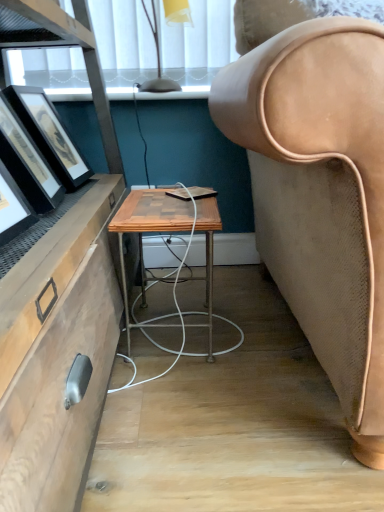
Question: Does wooden/matte desk at center have a lesser height compared to translucent yellow glass lampshade at upper center?

Choices:
 (A) no
 (B) yes

Answer: (A)

Question: Is wooden/matte desk at center looking in the opposite direction of translucent yellow glass lampshade at upper center?

Choices:
 (A) no
 (B) yes

Answer: (A)

Question: Is wooden/matte desk at center further to camera compared to translucent yellow glass lampshade at upper center?

Choices:
 (A) no
 (B) yes

Answer: (A)

Question: Is wooden/matte desk at center with translucent yellow glass lampshade at upper center?

Choices:
 (A) no
 (B) yes

Answer: (A)

Question: Can you confirm if wooden/matte desk at center is positioned to the left of translucent yellow glass lampshade at upper center?

Choices:
 (A) no
 (B) yes

Answer: (A)

Question: In the image, is wooden/matte desk at center positioned in front of or behind matte black picture frame at left?

Choices:
 (A) behind
 (B) front

Answer: (B)

Question: From their relative heights in the image, would you say wooden/matte desk at center is taller or shorter than matte black picture frame at left?

Choices:
 (A) tall
 (B) short

Answer: (A)

Question: From the image's perspective, is wooden/matte desk at center positioned above or below matte black picture frame at left?

Choices:
 (A) below
 (B) above

Answer: (A)

Question: Choose the correct answer: Is wooden/matte desk at center inside matte black picture frame at left or outside it?

Choices:
 (A) inside
 (B) outside

Answer: (B)

Question: From a real-world perspective, is matte black picture frame at left positioned above or below translucent yellow glass lampshade at upper center?

Choices:
 (A) below
 (B) above

Answer: (A)

Question: Looking at the image, does matte black picture frame at left seem bigger or smaller compared to translucent yellow glass lampshade at upper center?

Choices:
 (A) big
 (B) small

Answer: (A)

Question: In the image, is matte black picture frame at left on the left side or the right side of translucent yellow glass lampshade at upper center?

Choices:
 (A) left
 (B) right

Answer: (A)

Question: In terms of height, does matte black picture frame at left look taller or shorter compared to translucent yellow glass lampshade at upper center?

Choices:
 (A) short
 (B) tall

Answer: (B)

Question: Would you say wooden/matte desk at center is to the left or to the right of translucent yellow glass lampshade at upper center in the picture?

Choices:
 (A) left
 (B) right

Answer: (B)

Question: From their relative heights in the image, would you say wooden/matte desk at center is taller or shorter than translucent yellow glass lampshade at upper center?

Choices:
 (A) short
 (B) tall

Answer: (B)